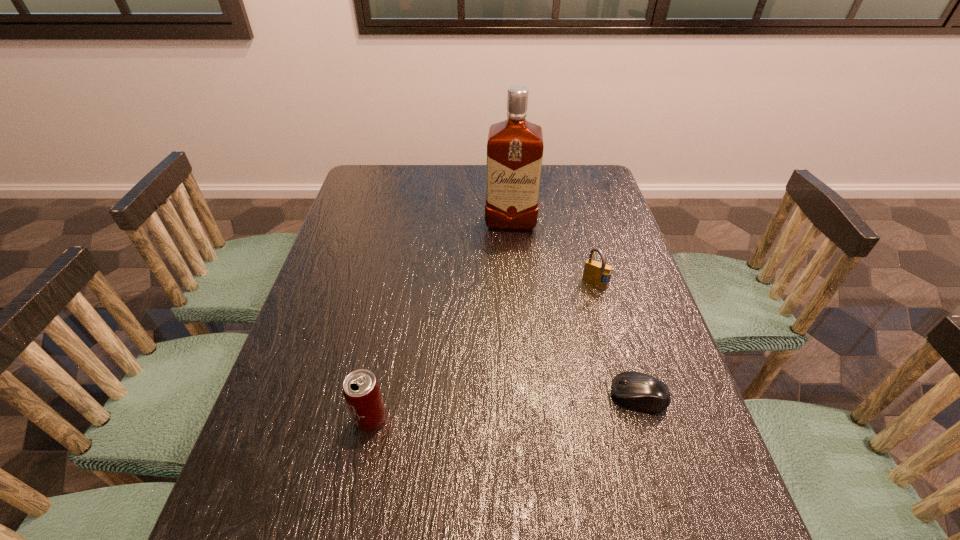
Find the location of a particular element. Image resolution: width=960 pixels, height=540 pixels. vacant space positioned on the front label of the farthest object is located at coordinates (508, 283).

This screenshot has height=540, width=960. What are the coordinates of `vacant region located 0.080m on the front label of the farthest object` in the screenshot? It's located at pyautogui.click(x=509, y=250).

Where is `vacant region located 0.080m on the front label of the farthest object`? This screenshot has width=960, height=540. vacant region located 0.080m on the front label of the farthest object is located at coordinates (509, 250).

Image resolution: width=960 pixels, height=540 pixels. I want to click on mouse that is at the right edge, so click(x=638, y=390).

Identify the location of padlock that is at the right edge. This screenshot has width=960, height=540. (595, 272).

Identify the location of vacant space at the far edge of the desktop. Image resolution: width=960 pixels, height=540 pixels. (451, 190).

Find the location of a particular element. free location at the near edge is located at coordinates (580, 470).

This screenshot has width=960, height=540. In the image, there is a desktop. What are the coordinates of `vacant space at the left edge` in the screenshot? It's located at (351, 275).

This screenshot has width=960, height=540. Find the location of `vacant space at the right edge of the desktop`. vacant space at the right edge of the desktop is located at coordinates (612, 335).

Where is `vacant space at the far left corner of the desktop`? vacant space at the far left corner of the desktop is located at coordinates (390, 195).